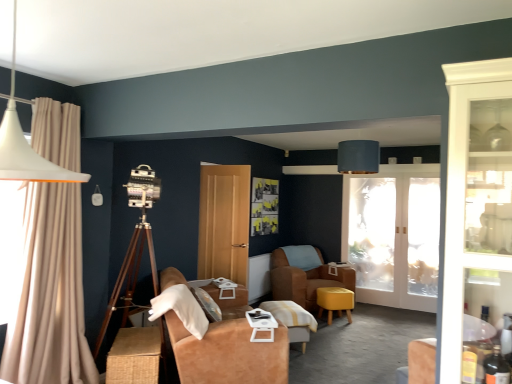
Where is `white matte pendant lamp at upper left`? The image size is (512, 384). white matte pendant lamp at upper left is located at coordinates (25, 144).

Measure the distance between frosted glass window screen at center and camera.

The distance of frosted glass window screen at center from camera is 5.55 meters.

In order to face frosted glass window screen at center, should I rotate leftwards or rightwards?

A 15.324 degree turn to the right will do.

What do you see at coordinates (358, 157) in the screenshot?
I see `matte blue fabric table lamp at upper center` at bounding box center [358, 157].

In the scene shown: What is the approximate height of suede-like brown couch at center?

It is 33.37 inches.

Describe the element at coordinates (293, 320) in the screenshot. The height and width of the screenshot is (384, 512). I see `wooden table at center, which appears as the 1th table when viewed from the back` at that location.

Measure the distance between light brown wood door at center and camera.

light brown wood door at center is 5.20 meters from camera.

At what (x,y) coordinates should I click in order to perform the action: click on white matte pendant lamp at upper left. Please return your answer as a coordinate pair (x, y). Looking at the image, I should click on (25, 144).

Which is behind, point (139, 364) or point (279, 311)?

The point (279, 311) is farther from the camera.

From a real-world perspective, is woven brown table at lower left, arranged as the 3th table when viewed from the right, located beneath wooden table at center, which appears as the 1th table when viewed from the back?

Yes, from a real-world perspective, woven brown table at lower left, arranged as the 3th table when viewed from the right, is below wooden table at center, which appears as the 1th table when viewed from the back.

From the picture: From the image's perspective, between woven brown table at lower left, the 2th table viewed from the front, and wooden table at center, the third table viewed from the left, who is located below?

wooden table at center, the third table viewed from the left, from the image's perspective.

In terms of height, does woven brown table at lower left, arranged as the 3th table when viewed from the right, look taller or shorter compared to wooden table at center, the third table viewed from the left?

Considering their sizes, woven brown table at lower left, arranged as the 3th table when viewed from the right, has less height than wooden table at center, the third table viewed from the left.

From a real-world perspective, between white matte pendant lamp at upper left and light brown wood door at center, who is vertically higher?

white matte pendant lamp at upper left.

Between white matte pendant lamp at upper left and light brown wood door at center, which one has larger size?

With larger size is light brown wood door at center.

Where is `light fixture above the light brown wood door at center (from the image's perspective)`? light fixture above the light brown wood door at center (from the image's perspective) is located at coordinates (25, 144).

Is point (22, 180) positioned before point (225, 249)?

Yes.

Which of these two, suede-like brown couch at center or matte yellow stool at center, is wider?

With larger width is suede-like brown couch at center.

Does suede-like brown couch at center appear on the left side of matte yellow stool at center?

Indeed, suede-like brown couch at center is positioned on the left side of matte yellow stool at center.

Looking at the image, does suede-like brown couch at center seem bigger or smaller compared to matte yellow stool at center?

Clearly, suede-like brown couch at center is larger in size than matte yellow stool at center.

Considering the points (280, 375) and (337, 299), which point is in front, point (280, 375) or point (337, 299)?

The point (280, 375) is in front.

Based on the photo, considering the positions of objects white matte pendant lamp at upper left and suede-like brown couch at center in the image provided, who is more to the right, white matte pendant lamp at upper left or suede-like brown couch at center?

suede-like brown couch at center.

Which is in front, point (6, 168) or point (279, 333)?

Point (6, 168)

From a real-world perspective, does white matte pendant lamp at upper left sit lower than suede-like brown couch at center?

Incorrect, from a real-world perspective, white matte pendant lamp at upper left is higher than suede-like brown couch at center.

Is white matte pendant lamp at upper left far away from suede-like brown couch at center?

white matte pendant lamp at upper left is positioned a significant distance from suede-like brown couch at center.

Consider the image. Is white plastic tray at center, marked as the 2th table in a left-to-right arrangement, further to camera compared to suede-like brown couch at center?

Yes.

Which is farther from the camera, (x=264, y=325) or (x=180, y=372)?

Positioned behind is point (x=264, y=325).

From the image's perspective, which object appears higher, white plastic tray at center, which appears as the 3th table when viewed from the back, or suede-like brown couch at center?

white plastic tray at center, which appears as the 3th table when viewed from the back.

Which of these two, white plastic tray at center, which appears as the 3th table when viewed from the back, or suede-like brown couch at center, is bigger?

suede-like brown couch at center.

Is white matte pendant lamp at upper left completely or partially outside of wooden table at center, placed as the 1th table when sorted from right to left?

That's correct, white matte pendant lamp at upper left is outside of wooden table at center, placed as the 1th table when sorted from right to left.

From the image's perspective, is white matte pendant lamp at upper left located above wooden table at center, acting as the 3th table starting from the front?

Yes, from the image's perspective, white matte pendant lamp at upper left is above wooden table at center, acting as the 3th table starting from the front.

Could you tell me if white matte pendant lamp at upper left is facing wooden table at center, the third table viewed from the left?

No, white matte pendant lamp at upper left is not aimed at wooden table at center, the third table viewed from the left.

Considering the sizes of objects matte blue fabric table lamp at upper center and suede-like brown couch at center in the image provided, who is shorter, matte blue fabric table lamp at upper center or suede-like brown couch at center?

matte blue fabric table lamp at upper center is shorter.

Is suede-like brown couch at center completely or partially inside matte blue fabric table lamp at upper center?

No, suede-like brown couch at center is located outside of matte blue fabric table lamp at upper center.

Is matte blue fabric table lamp at upper center smaller than suede-like brown couch at center?

Yes, matte blue fabric table lamp at upper center is smaller than suede-like brown couch at center.

Locate an element on the screen. The width and height of the screenshot is (512, 384). table that appears below the woven brown table at lower left, the 2th table viewed from the front (from the image's perspective) is located at coordinates (293, 320).

Where is `light fixture located in front of the light brown wood door at center`? The image size is (512, 384). light fixture located in front of the light brown wood door at center is located at coordinates 25,144.

When comparing their distances from wooden table at center, acting as the 3th table starting from the front, does white matte pendant lamp at upper left or frosted glass window screen at center seem closer?

frosted glass window screen at center is closer to wooden table at center, acting as the 3th table starting from the front.

From the image, which object appears to be farther from light brown wood door at center, woven brown table at lower left, the first table viewed from the left, or wooden table at center, acting as the 3th table starting from the front?

woven brown table at lower left, the first table viewed from the left, is further to light brown wood door at center.

When comparing their distances from matte yellow stool at center, does matte blue fabric table lamp at upper center or woven brown table at lower left, the 2th table viewed from the front, seem further?

woven brown table at lower left, the 2th table viewed from the front, is positioned further to the anchor matte yellow stool at center.

When comparing their distances from matte blue fabric table lamp at upper center, does beige fabric curtain at left or wooden table at center, placed as the 1th table when sorted from right to left, seem further?

beige fabric curtain at left.

Estimate the real-world distances between objects in this image. Which object is further from matte blue fabric table lamp at upper center, woven brown table at lower left, the 2th table viewed from the front, or suede-like brown couch at center?

woven brown table at lower left, the 2th table viewed from the front, is positioned further to the anchor matte blue fabric table lamp at upper center.

Looking at the image, which one is located closer to white plastic tray at center, marked as the 2th table in a left-to-right arrangement, beige fabric curtain at left or light brown wood door at center?

beige fabric curtain at left lies closer to white plastic tray at center, marked as the 2th table in a left-to-right arrangement, than the other object.

Considering their positions, is woven brown table at lower left, the 2th table viewed from the front, positioned further to wooden tripod at left than white plastic tray at center, the 2th table when ordered from right to left?

The object further to wooden tripod at left is white plastic tray at center, the 2th table when ordered from right to left.

Which object lies nearer to the anchor point white matte pendant lamp at upper left, beige fabric curtain at left or matte yellow stool at center?

Based on the image, beige fabric curtain at left appears to be nearer to white matte pendant lamp at upper left.

Image resolution: width=512 pixels, height=384 pixels. I want to click on door between white plastic tray at center, the 1th table in the front-to-back sequence, and frosted glass window screen at center, along the z-axis, so click(x=224, y=222).

The image size is (512, 384). In order to click on table lamp located between woven brown table at lower left, arranged as the 3th table when viewed from the right, and frosted glass window screen at center in the depth direction in this screenshot , I will do (x=358, y=157).

Find the location of a particular element. The image size is (512, 384). tripod between woven brown table at lower left, which appears as the second table when viewed from the back, and suede brown armchair at center, along the z-axis is located at coordinates (130, 278).

Identify the location of studio couch located between beige fabric curtain at left and frosted glass window screen at center in the depth direction. The height and width of the screenshot is (384, 512). (228, 347).